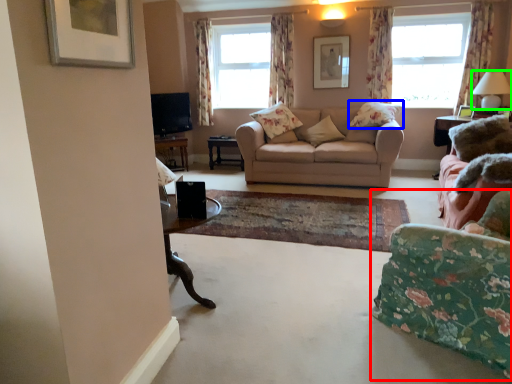
Question: Which is nearer to the chair (highlighted by a red box)? pillow (highlighted by a blue box) or lamp (highlighted by a green box).

Choices:
 (A) pillow
 (B) lamp

Answer: (A)